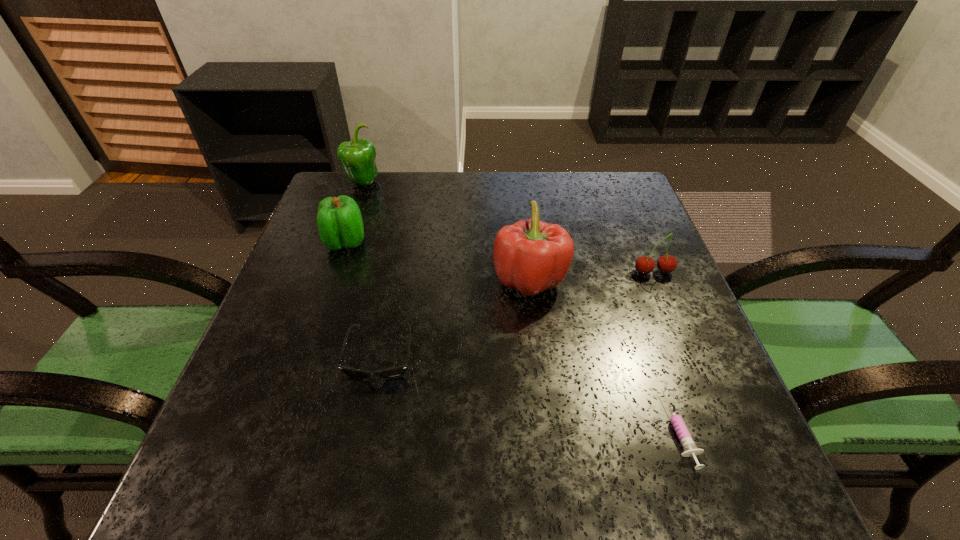
This screenshot has width=960, height=540. I want to click on blank area at the far edge, so click(x=535, y=184).

This screenshot has width=960, height=540. In order to click on blank space at the left edge in this screenshot , I will do `click(295, 276)`.

Locate an element on the screen. This screenshot has width=960, height=540. vacant area at the right edge of the desktop is located at coordinates (648, 221).

This screenshot has width=960, height=540. In the image, there is a desktop. Identify the location of vacant region at the far left corner. (344, 171).

What are the coordinates of `free location at the far right corner of the desktop` in the screenshot? It's located at click(604, 197).

Locate an element on the screen. The height and width of the screenshot is (540, 960). free space at the near right corner is located at coordinates (710, 465).

Find the location of a particular element. free spot between the farthest object and the fourth object from left to right is located at coordinates (445, 231).

Locate an element on the screen. This screenshot has width=960, height=540. unoccupied area between the nearest object and the shortest bell pepper is located at coordinates (514, 335).

Image resolution: width=960 pixels, height=540 pixels. What are the coordinates of `vacant area between the shortest object and the fourth object from left to right` in the screenshot? It's located at (606, 354).

Where is `vacant area that lies between the farthest object and the fourth object from left to right`? vacant area that lies between the farthest object and the fourth object from left to right is located at coordinates (445, 231).